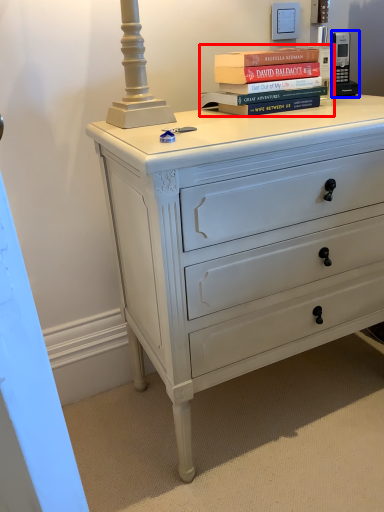
Question: Which object appears farthest to the camera in this image, book (highlighted by a red box) or gadget (highlighted by a blue box)?

Choices:
 (A) book
 (B) gadget

Answer: (B)